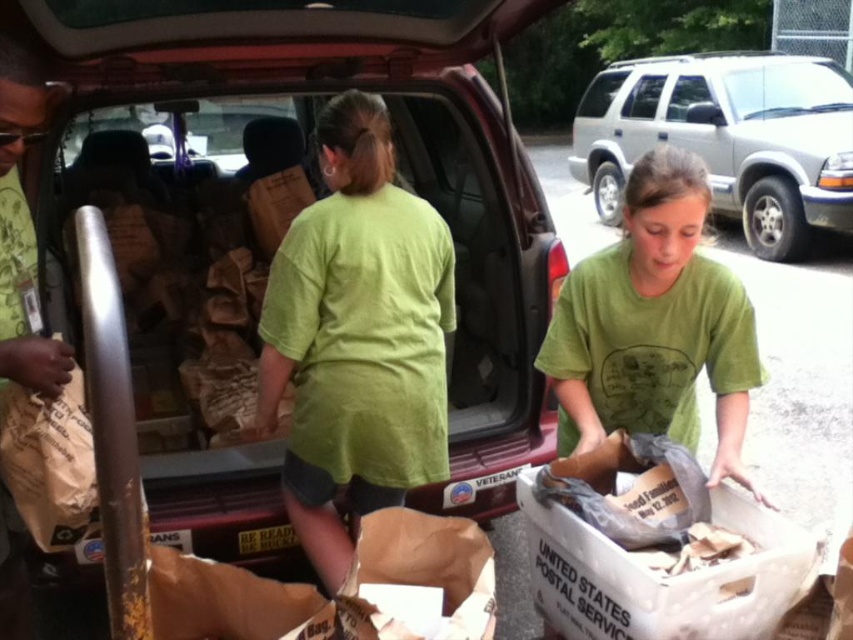
Who is positioned more to the left, green matte shirt at center or silver metallic minivan at upper right?

Positioned to the left is green matte shirt at center.

Image resolution: width=853 pixels, height=640 pixels. Describe the element at coordinates (654, 324) in the screenshot. I see `green matte shirt at center` at that location.

The image size is (853, 640). I want to click on green matte shirt at center, so click(654, 324).

Who is shorter, matte brown paper bag at center or green cotton shirt at center?

Standing shorter between the two is green cotton shirt at center.

Where is `matte brown paper bag at center`? The image size is (853, 640). matte brown paper bag at center is located at coordinates (273, 248).

Is point (281, 170) farther from viewer compared to point (416, 260)?

Yes, it is behind point (416, 260).

Locate an element on the screen. The width and height of the screenshot is (853, 640). matte brown paper bag at center is located at coordinates (273, 248).

Does matte brown paper bag at center have a lesser width compared to silver metallic minivan at upper right?

In fact, matte brown paper bag at center might be wider than silver metallic minivan at upper right.

What do you see at coordinates (273, 248) in the screenshot? This screenshot has height=640, width=853. I see `matte brown paper bag at center` at bounding box center [273, 248].

Identify the location of matte brown paper bag at center. (273, 248).